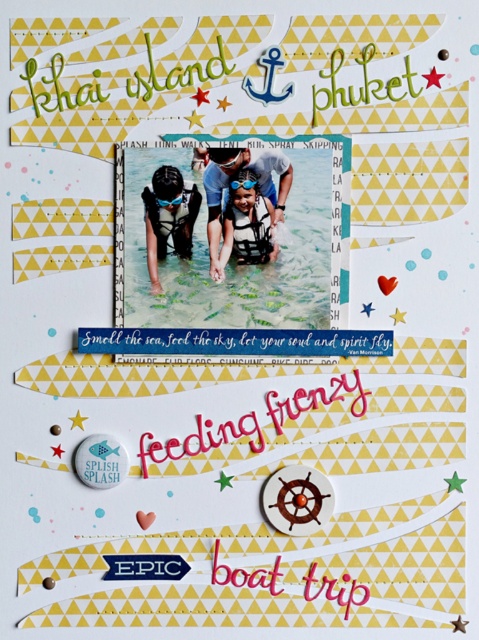
Question: From the image, what is the correct spatial relationship of clear water at center in relation to matte green snorkel at center?

Choices:
 (A) right
 (B) left

Answer: (A)

Question: Estimate the real-world distances between objects in this image. Which object is farther from the white life vest at center?

Choices:
 (A) matte green snorkel at center
 (B) clear water at center

Answer: (A)

Question: Can you confirm if clear water at center is positioned to the left of white life vest at center?

Choices:
 (A) no
 (B) yes

Answer: (B)

Question: Estimate the real-world distances between objects in this image. Which object is farther from the clear water at center?

Choices:
 (A) white life vest at center
 (B) matte green snorkel at center

Answer: (B)

Question: Which point is farther from the camera taking this photo?

Choices:
 (A) tap(182, 225)
 (B) tap(228, 227)

Answer: (A)

Question: From the image, what is the correct spatial relationship of clear water at center in relation to matte green snorkel at center?

Choices:
 (A) right
 (B) left

Answer: (A)